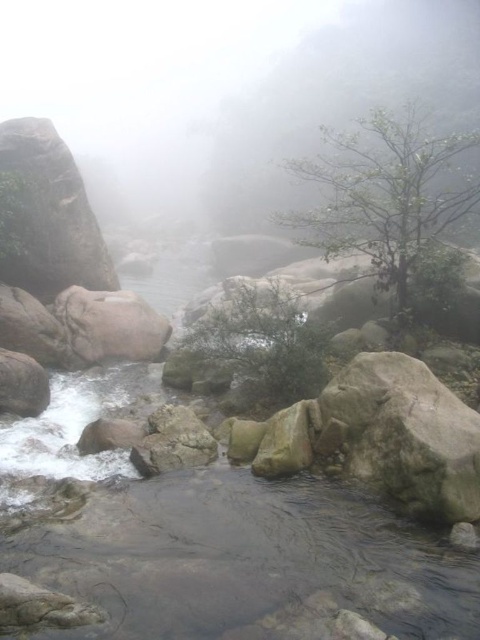
Which of these two, clear water at center or smooth granite boulder at left, stands shorter?

Standing shorter between the two is clear water at center.

The width and height of the screenshot is (480, 640). Describe the element at coordinates (216, 538) in the screenshot. I see `clear water at center` at that location.

Is point (392, 609) closer to camera compared to point (83, 275)?

That is True.

The height and width of the screenshot is (640, 480). Identify the location of clear water at center. (216, 538).